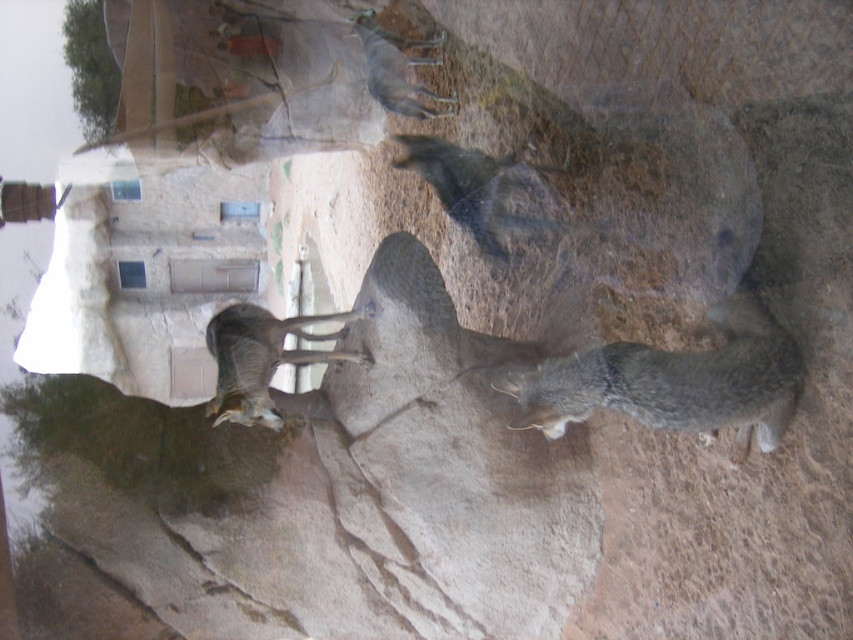
Question: Which of the following is the farthest from the observer?

Choices:
 (A) (397, 97)
 (B) (231, 378)

Answer: (A)

Question: Can you confirm if gray fur antelope at center is bigger than gray fur goat at upper center?

Choices:
 (A) no
 (B) yes

Answer: (A)

Question: Which object is farther from the camera taking this photo?

Choices:
 (A) gray fur antelope at center
 (B) gray fur cat at lower right
 (C) gray fur goat at upper center

Answer: (C)

Question: Is gray fur antelope at center bigger than gray fur goat at upper center?

Choices:
 (A) no
 (B) yes

Answer: (A)

Question: Where is gray fur cat at lower right located in relation to gray fur antelope at center in the image?

Choices:
 (A) left
 (B) right

Answer: (B)

Question: Which point is farther to the camera?

Choices:
 (A) gray fur cat at lower right
 (B) gray fur antelope at center
 (C) gray fur goat at upper center

Answer: (C)